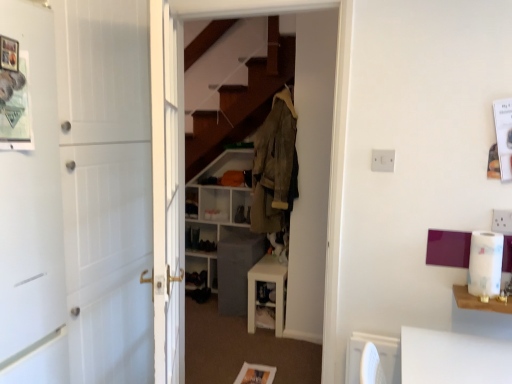
The width and height of the screenshot is (512, 384). Describe the element at coordinates (240, 214) in the screenshot. I see `dark gray fabric shoe at center` at that location.

This screenshot has width=512, height=384. What do you see at coordinates (276, 291) in the screenshot? I see `white glossy cabinet at center` at bounding box center [276, 291].

What is the approximate height of white plastic shelf at center, which is the 1th shelf in top-to-bottom order?

14.75 centimeters.

The width and height of the screenshot is (512, 384). Find the location of `wooden dresser at center`. wooden dresser at center is located at coordinates (251, 159).

Measure the distance between wooden dresser at center and camera.

A distance of 9.03 feet exists between wooden dresser at center and camera.

Where is `white wood door at left`? The height and width of the screenshot is (384, 512). white wood door at left is located at coordinates (106, 186).

From a real-world perspective, which is physically below, white plastic shelf at center, which is the 1th shelf from bottom to top, or white plastic table at right?

In real-world perspective, white plastic shelf at center, which is the 1th shelf from bottom to top, is lower.

Is white plastic shelf at center, which is the 1th shelf from bottom to top, beside white plastic table at right?

They are not placed beside each other.

How different are the orientations of white plastic shelf at center, which ranks as the second shelf in top-to-bottom order, and white plastic table at right in degrees?

white plastic shelf at center, which ranks as the second shelf in top-to-bottom order, and white plastic table at right are facing 0.118 degrees away from each other.

In the image, is white plastic shelf at center, which ranks as the second shelf in top-to-bottom order, positioned in front of or behind white plastic table at right?

white plastic shelf at center, which ranks as the second shelf in top-to-bottom order, is behind white plastic table at right.

From the image's perspective, between white plastic shelf at center, which is the 1th shelf in top-to-bottom order, and white plastic table at right, which one is located above?

white plastic shelf at center, which is the 1th shelf in top-to-bottom order.

In the image, is white plastic shelf at center, which is the 1th shelf in top-to-bottom order, positioned in front of or behind white plastic table at right?

Clearly, white plastic shelf at center, which is the 1th shelf in top-to-bottom order, is behind white plastic table at right.

Can you confirm if white plastic shelf at center, placed as the second shelf when sorted from bottom to top, is thinner than white plastic table at right?

No.

Considering the positions of points (193, 202) and (507, 299), is point (193, 202) closer to camera compared to point (507, 299)?

No, (193, 202) is behind (507, 299).

From the image's perspective, which one is positioned lower, white plastic table at right or white plastic shelf at center, placed as the second shelf when sorted from bottom to top?

white plastic table at right.

Where is `table that appears below the white plastic shelf at center, placed as the second shelf when sorted from bottom to top (from the image's perspective)`? The image size is (512, 384). table that appears below the white plastic shelf at center, placed as the second shelf when sorted from bottom to top (from the image's perspective) is located at coordinates (479, 301).

Looking at the image, does white plastic table at right seem bigger or smaller compared to white plastic shelf at center, placed as the second shelf when sorted from bottom to top?

In the image, white plastic table at right appears to be larger than white plastic shelf at center, placed as the second shelf when sorted from bottom to top.

Would you say white plastic table at right is to the left or to the right of white plastic shelf at center, which is the 1th shelf in top-to-bottom order, in the picture?

white plastic table at right is to the right of white plastic shelf at center, which is the 1th shelf in top-to-bottom order.

Which object is positioned more to the right, dark gray fabric shoe at center or white wood door at left?

dark gray fabric shoe at center.

Identify the location of shoe below the white wood door at left (from the image's perspective). (240, 214).

How different are the orientations of dark gray fabric shoe at center and white wood door at left in degrees?

They differ by 90 degrees in their facing directions.

Locate an element on the screen. This screenshot has width=512, height=384. clothing that is above the dark gray fabric shoe at center (from a real-world perspective) is located at coordinates (274, 166).

From a real-world perspective, which object stands above the other?

camouflage fabric jacket at center, from a real-world perspective.

From the image's perspective, between camouflage fabric jacket at center and dark gray fabric shoe at center, who is located below?

dark gray fabric shoe at center is shown below in the image.

Is there a large distance between camouflage fabric jacket at center and dark gray fabric shoe at center?

Yes, camouflage fabric jacket at center is far from dark gray fabric shoe at center.

Is white glossy cabinet at center facing away from camouflage fabric jacket at center?

No, white glossy cabinet at center is not facing away from camouflage fabric jacket at center.

How different are the orientations of white glossy cabinet at center and camouflage fabric jacket at center in degrees?

90 degrees separate the facing orientations of white glossy cabinet at center and camouflage fabric jacket at center.

Is white glossy cabinet at center surrounding camouflage fabric jacket at center?

Actually, camouflage fabric jacket at center is outside white glossy cabinet at center.

Is white glossy cabinet at center far from camouflage fabric jacket at center?

No, there isn't a large distance between white glossy cabinet at center and camouflage fabric jacket at center.

Does white plastic shelf at center, which ranks as the second shelf in top-to-bottom order, have a lesser height compared to dark gray fabric shoe at center?

No, white plastic shelf at center, which ranks as the second shelf in top-to-bottom order, is not shorter than dark gray fabric shoe at center.

Where is `shoe located behind the white plastic shelf at center, which is the 1th shelf from bottom to top`? This screenshot has width=512, height=384. shoe located behind the white plastic shelf at center, which is the 1th shelf from bottom to top is located at coordinates (240, 214).

Is dark gray fabric shoe at center at the back of white plastic shelf at center, which is the 1th shelf from bottom to top?

Correct, white plastic shelf at center, which is the 1th shelf from bottom to top, is looking away from dark gray fabric shoe at center.

From a real-world perspective, which object rests below the other?

white plastic shelf at center, which is the 1th shelf from bottom to top, from a real-world perspective.

The height and width of the screenshot is (384, 512). Identify the location of table in front of the white plastic shelf at center, which ranks as the second shelf in top-to-bottom order. (479, 301).

The height and width of the screenshot is (384, 512). Find the location of `table lying on the right of white plastic shelf at center, which is the 1th shelf in top-to-bottom order`. table lying on the right of white plastic shelf at center, which is the 1th shelf in top-to-bottom order is located at coordinates (479, 301).

Which object lies nearer to the anchor point white plastic shelf at center, which is the 1th shelf in top-to-bottom order, white glossy cabinet at center or white wood door at left?

Based on the image, white glossy cabinet at center appears to be nearer to white plastic shelf at center, which is the 1th shelf in top-to-bottom order.

When comparing their distances from wooden dresser at center, does white glossy cabinet at center or white plastic shelf at center, placed as the second shelf when sorted from bottom to top, seem further?

Based on the image, white plastic shelf at center, placed as the second shelf when sorted from bottom to top, appears to be further to wooden dresser at center.

Considering their positions, is white plastic table at right positioned closer to camouflage fabric jacket at center than white glossy cabinet at center?

Based on the image, white glossy cabinet at center appears to be nearer to camouflage fabric jacket at center.

Estimate the real-world distances between objects in this image. Which object is further from white plastic shelf at center, which is the 1th shelf in top-to-bottom order, white plastic shelf at center, which is the 1th shelf from bottom to top, or camouflage fabric jacket at center?

The object further to white plastic shelf at center, which is the 1th shelf in top-to-bottom order, is camouflage fabric jacket at center.

Based on their spatial positions, is white glossy cabinet at center or camouflage fabric jacket at center further from white plastic table at right?

white glossy cabinet at center is positioned further to the anchor white plastic table at right.

From the image, which object appears to be nearer to wooden dresser at center, white wood door at left or white plastic shelf at center, which is the 1th shelf in top-to-bottom order?

white plastic shelf at center, which is the 1th shelf in top-to-bottom order, is positioned closer to the anchor wooden dresser at center.

From the picture: Estimate the real-world distances between objects in this image. Which object is further from white wood door at left, camouflage fabric jacket at center or dark gray fabric shoe at center?

dark gray fabric shoe at center is positioned further to the anchor white wood door at left.

Considering their positions, is camouflage fabric jacket at center positioned further to white glossy cabinet at center than white plastic shelf at center, which is the 1th shelf in top-to-bottom order?

The object further to white glossy cabinet at center is white plastic shelf at center, which is the 1th shelf in top-to-bottom order.

What are the coordinates of `clothing located between wooden dresser at center and white plastic shelf at center, which is the 1th shelf from bottom to top, in the depth direction` in the screenshot? It's located at (274, 166).

This screenshot has width=512, height=384. Identify the location of shelf positioned between white plastic table at right and dark gray fabric shoe at center from near to far. (215, 210).

This screenshot has width=512, height=384. Identify the location of table between white wood door at left and white glossy cabinet at center in the front-back direction. (479, 301).

Where is `dresser situated between white wood door at left and white plastic table at right from left to right`? The image size is (512, 384). dresser situated between white wood door at left and white plastic table at right from left to right is located at coordinates (251, 159).